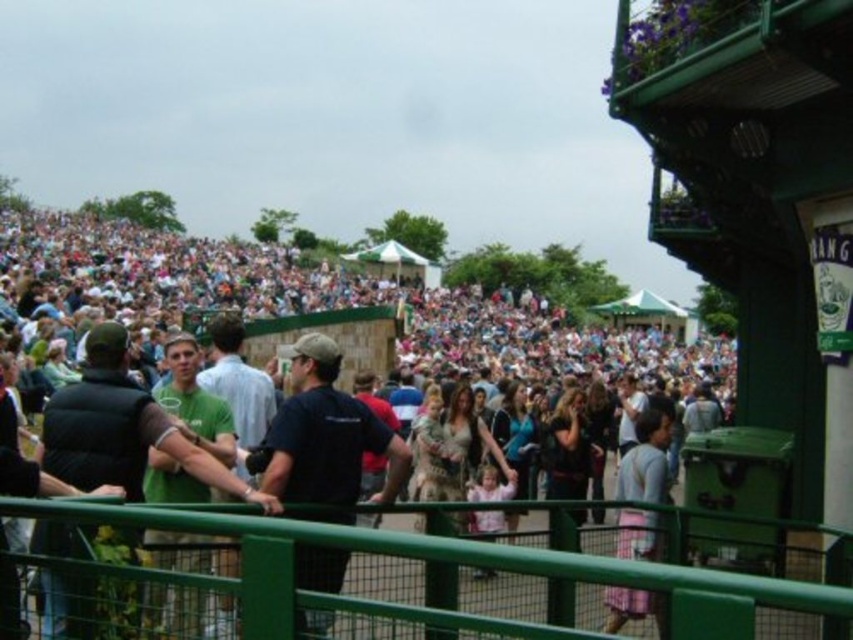
Question: Which of these objects is positioned farthest from the green painted metal fence at lower center?

Choices:
 (A) pink fabric dress at center
 (B) matte black crowd at center

Answer: (B)

Question: Is the position of matte black crowd at center less distant than that of green fabric jacket at left?

Choices:
 (A) yes
 (B) no

Answer: (B)

Question: Which point is closer to the camera taking this photo?

Choices:
 (A) (334, 413)
 (B) (38, 544)
 (C) (633, 548)
 (D) (503, 486)

Answer: (B)

Question: Is green painted metal fence at lower center below dark blue t-shirt at center?

Choices:
 (A) yes
 (B) no

Answer: (A)

Question: Among these objects, which one is nearest to the camera?

Choices:
 (A) dark blue t-shirt at center
 (B) green painted metal fence at lower center
 (C) pink fabric dress at center
 (D) green fabric jacket at left

Answer: (B)

Question: Does matte black crowd at center appear under pink fabric dress at center?

Choices:
 (A) no
 (B) yes

Answer: (A)